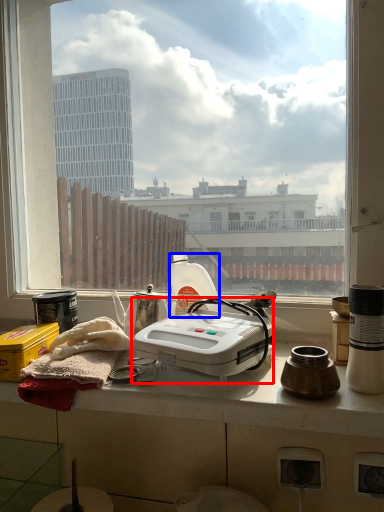
Question: Which object is closer to the camera taking this photo, kitchen appliance (highlighted by a red box) or bottle (highlighted by a blue box)?

Choices:
 (A) kitchen appliance
 (B) bottle

Answer: (A)